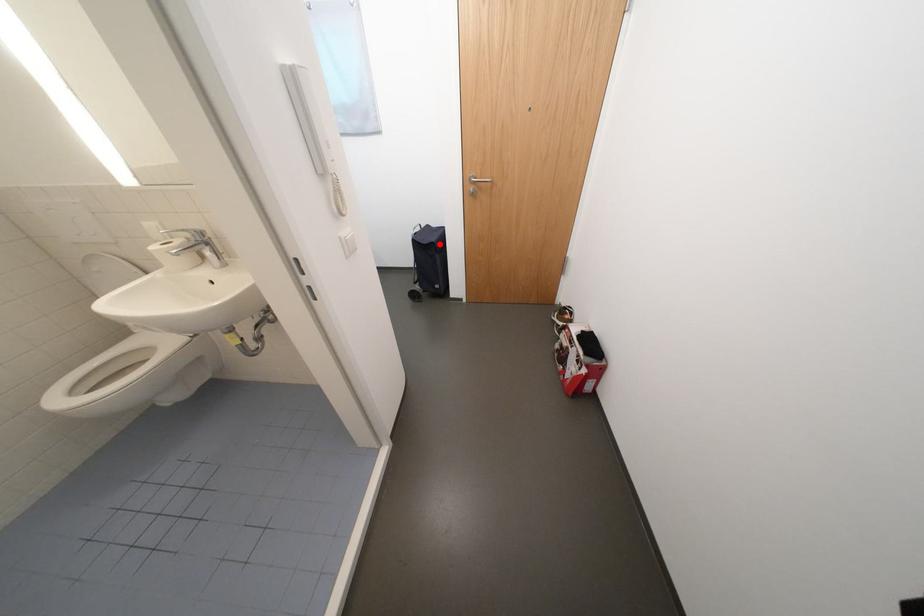
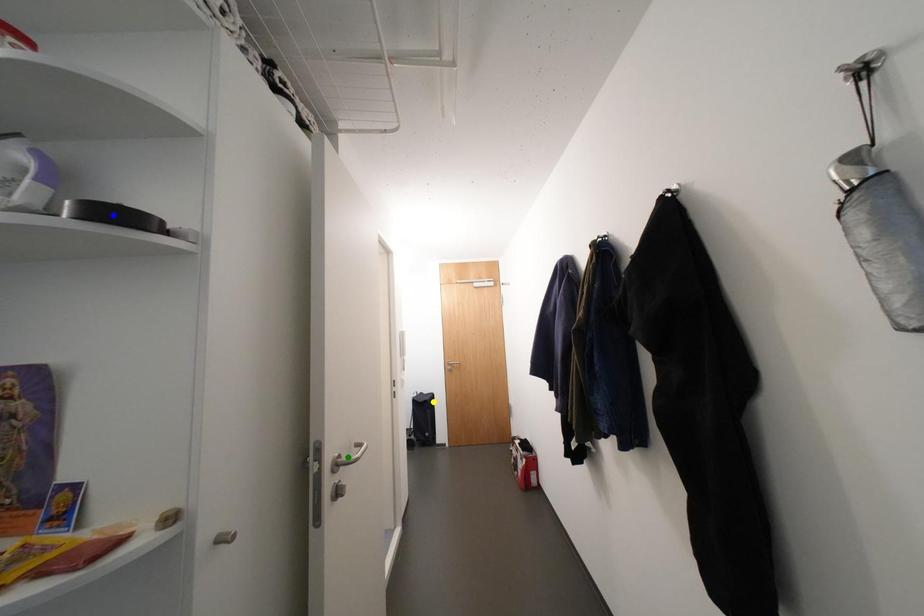
Question: I am providing you with two images of the same scene from different viewpoints. A red point is marked on the first image. You are given multiple points on the second image. Which point in image 2 is actually the same real-world point as the red point in image 1?

Choices:
 (A) yellow point
 (B) blue point
 (C) green point

Answer: (A)